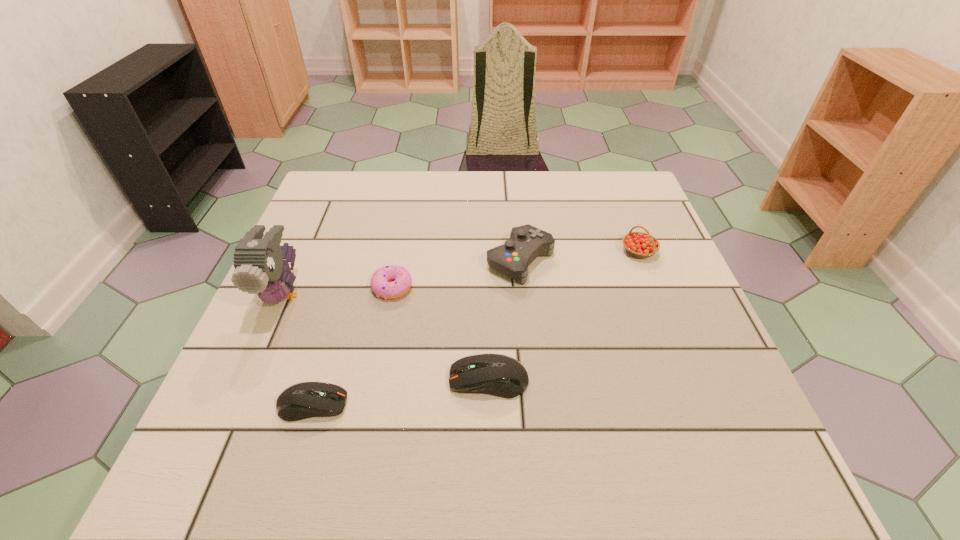
Where is `vacant space at the far edge of the desktop`? This screenshot has width=960, height=540. vacant space at the far edge of the desktop is located at coordinates (511, 210).

The width and height of the screenshot is (960, 540). Find the location of `vacant space at the near edge`. vacant space at the near edge is located at coordinates (591, 424).

In the image, there is a desktop. What are the coordinates of `vacant space at the left edge` in the screenshot? It's located at point(279,328).

You are a GUI agent. You are given a task and a screenshot of the screen. Output one action in this format:
    pyautogui.click(x=<x>, y=<y>)
    Task: Click on the vacant space at the right edge
    
    Given the screenshot: What is the action you would take?
    pyautogui.click(x=650, y=302)

Identify the location of free spot at the far left corner of the desktop. (353, 188).

Locate an element on the screen. The image size is (960, 540). vacant position at the far right corner of the desktop is located at coordinates (600, 199).

Locate an element on the screen. Image resolution: width=960 pixels, height=540 pixels. vacant space that is in between the left computer equipment and the leftmost object is located at coordinates (298, 349).

The image size is (960, 540). I want to click on free space between the rightmost object and the left computer equipment, so click(475, 328).

Locate an element on the screen. The image size is (960, 540). empty space between the left computer equipment and the taller computer equipment is located at coordinates (400, 392).

This screenshot has height=540, width=960. In order to click on free point between the taller computer equipment and the doughnut in this screenshot , I will do `click(441, 334)`.